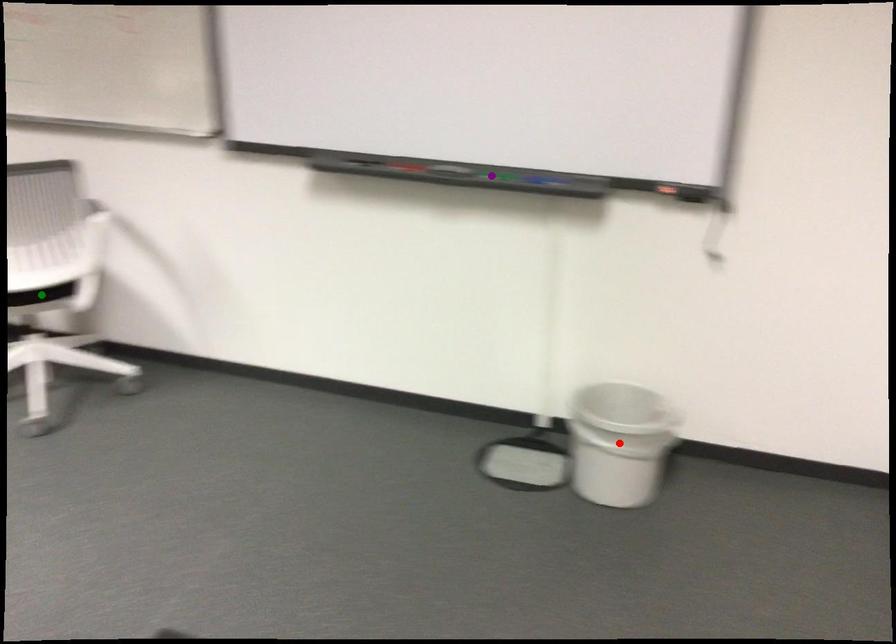
Order these from nearest to farthest:
purple point | green point | red point

red point
purple point
green point